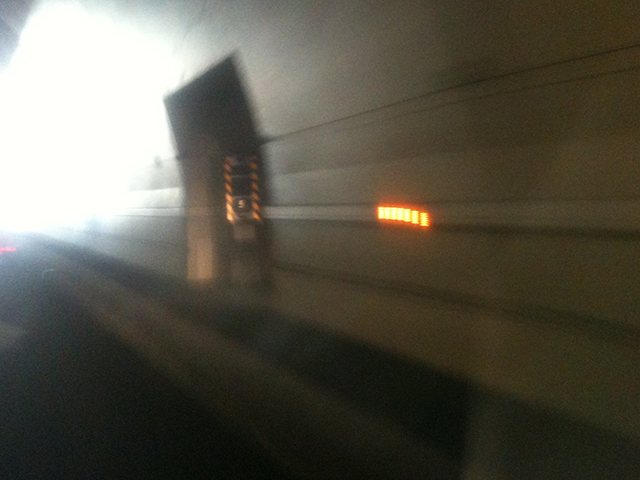
This screenshot has width=640, height=480. What are the coordinates of `ceiling` in the screenshot? It's located at (148, 11).